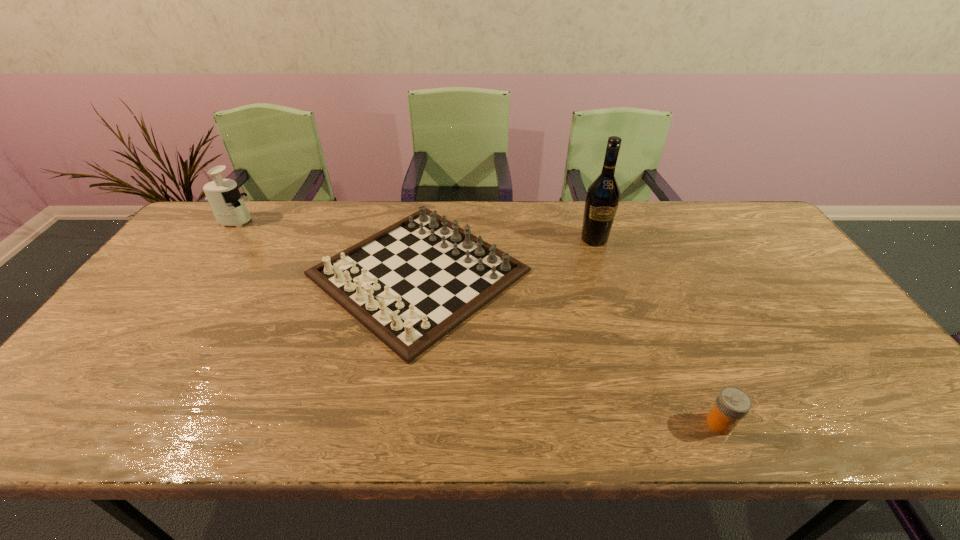
Find the location of a particular element. The height and width of the screenshot is (540, 960). wine bottle at the far edge is located at coordinates (603, 195).

The image size is (960, 540). I want to click on juicer that is at the far edge, so click(x=227, y=204).

Identify the location of chessboard situated at the far edge. Image resolution: width=960 pixels, height=540 pixels. (410, 284).

Image resolution: width=960 pixels, height=540 pixels. In order to click on object that is at the near edge in this screenshot , I will do `click(732, 404)`.

Image resolution: width=960 pixels, height=540 pixels. In order to click on object present at the left edge in this screenshot , I will do `click(227, 204)`.

I want to click on object that is at the far left corner, so (x=227, y=204).

In the image, there is a desktop. At what (x,y) coordinates should I click in order to perform the action: click on vacant region at the far edge. Please return your answer as a coordinate pair (x, y). The image size is (960, 540). Looking at the image, I should click on (372, 233).

The height and width of the screenshot is (540, 960). In the image, there is a desktop. In order to click on blank space at the near edge in this screenshot , I will do `click(311, 429)`.

I want to click on free space at the left edge, so click(x=182, y=274).

Where is `vacant space at the right edge`? This screenshot has width=960, height=540. vacant space at the right edge is located at coordinates (767, 247).